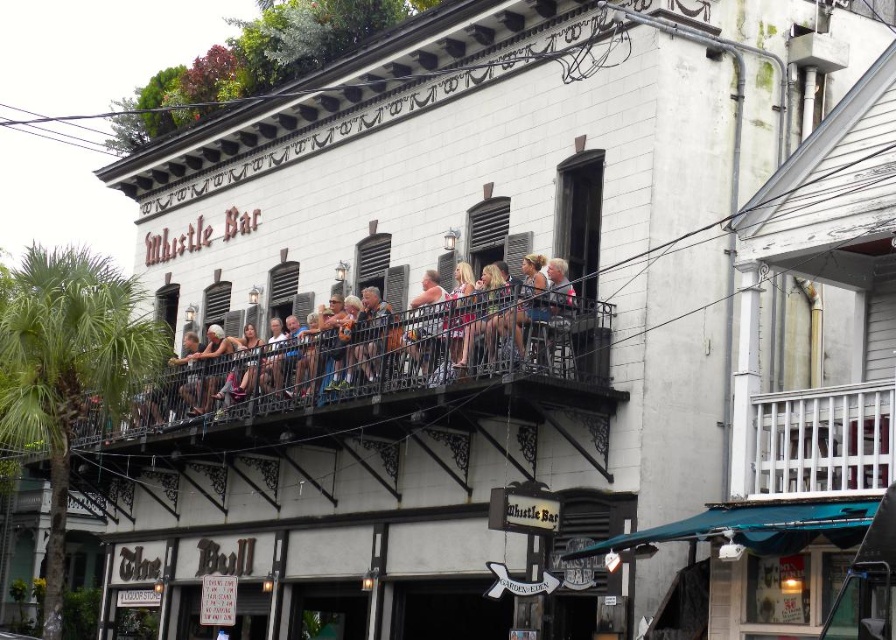
Is green leafy palm tree at left in front of matte pink tank top at center?

No, it is not.

Is point (7, 445) farther from viewer compared to point (438, 301)?

That is True.

Where is `green leafy palm tree at left`? This screenshot has height=640, width=896. green leafy palm tree at left is located at coordinates (67, 371).

Locate an element on the screen. The width and height of the screenshot is (896, 640). green leafy palm tree at left is located at coordinates (67, 371).

Is point (841, 474) in front of point (424, 305)?

Yes.

Which is more to the left, white wooden railing at upper center or matte pink tank top at center?

matte pink tank top at center

What do you see at coordinates (823, 440) in the screenshot?
I see `white wooden railing at upper center` at bounding box center [823, 440].

The image size is (896, 640). What are the coordinates of `white wooden railing at upper center` in the screenshot? It's located at (823, 440).

Does matte black balcony railing at center have a lesser width compared to matte pink tank top at center?

No, matte black balcony railing at center is not thinner than matte pink tank top at center.

Is point (174, 376) positioned before point (440, 352)?

That is False.

Locate an element on the screen. matte black balcony railing at center is located at coordinates (395, 346).